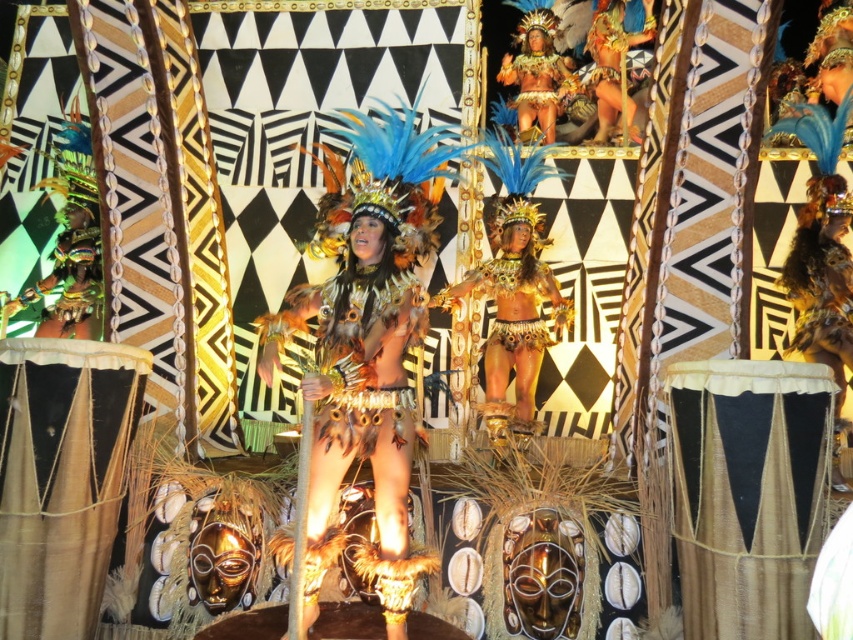
Question: Is feathered gold costume at center above shiny gold headdress at upper center?

Choices:
 (A) yes
 (B) no

Answer: (B)

Question: Which object is farther from the camera taking this photo?

Choices:
 (A) shiny gold headdress at upper center
 (B) shiny gold costume at upper center
 (C) gold metallic bikini at center
 (D) feathered gold costume at center

Answer: (A)

Question: Which of the following is the farthest from the observer?

Choices:
 (A) (514, 70)
 (B) (380, 426)

Answer: (A)

Question: Can you confirm if gold metallic bikini at center is positioned below gold metallic headdress at upper center?

Choices:
 (A) yes
 (B) no

Answer: (A)

Question: Which object appears farthest from the camera in this image?

Choices:
 (A) feathered gold costume at center
 (B) shiny gold costume at upper center
 (C) gold metallic bikini at center
 (D) shiny gold headdress at upper center

Answer: (D)

Question: Observing the image, what is the correct spatial positioning of feathered gold costume at center in reference to gold metallic bikini at center?

Choices:
 (A) below
 (B) above

Answer: (A)